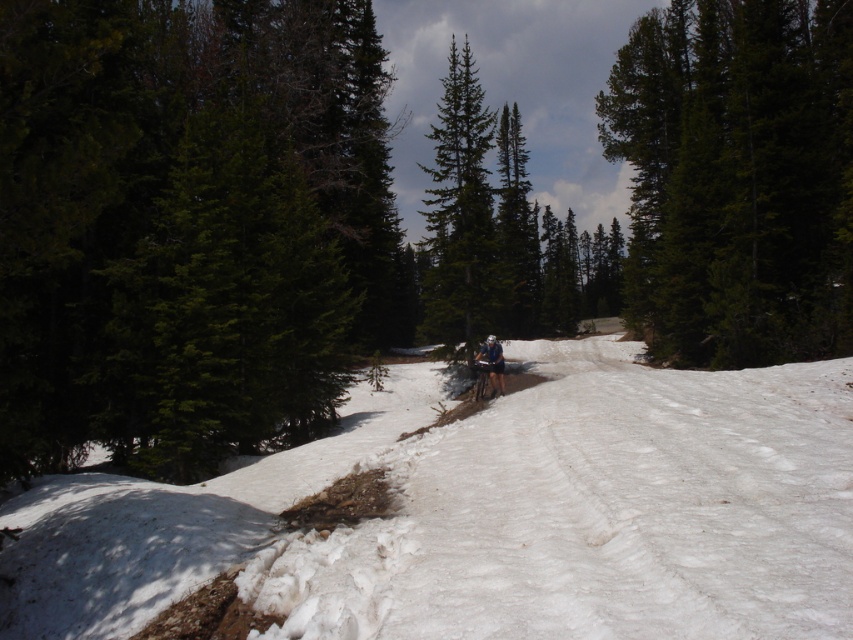
You are planning to build a snowman using the white powdery snow at center and want to place it near the green textured pine tree at center. Considering their widths, which object provides more material for the snowman?

The green textured pine tree at center has a greater width than the white powdery snow at center, so the snowman can be built using the snow from the white powery snow at center but the pine tree does not provide snow material. However, the question is about which provides more material, so the answer should focus on the snow. Wait, the objects description says the snow has lesser width than the tree. But snow is the material. Maybe the question is about which has more width, but the answer must use the obj

Consider the image. You are a hiker trying to locate a specific point marked as point (735,179) in the snowy forest scene. Based on the image, where is this point located?

The point (735,179) is located on the green matte tree at upper right.